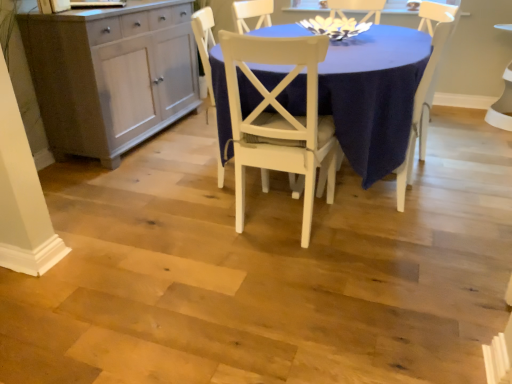
Question: From a real-world perspective, does white wood chair at center, which ranks as the first chair in right-to-left order, sit lower than matte gray cabinet at left?

Choices:
 (A) no
 (B) yes

Answer: (A)

Question: Is white wood chair at center, which is counted as the 3th chair, starting from the left, positioned far away from matte gray cabinet at left?

Choices:
 (A) yes
 (B) no

Answer: (A)

Question: Can you confirm if white wood chair at center, which is counted as the 3th chair, starting from the left, is positioned to the left of matte gray cabinet at left?

Choices:
 (A) yes
 (B) no

Answer: (B)

Question: Is white wood chair at center, which is counted as the 3th chair, starting from the left, taller than matte gray cabinet at left?

Choices:
 (A) no
 (B) yes

Answer: (B)

Question: Is white wood chair at center, which is counted as the 3th chair, starting from the left, wider than matte gray cabinet at left?

Choices:
 (A) yes
 (B) no

Answer: (B)

Question: From the image's perspective, is white wood chair at center, which ranks as the first chair in right-to-left order, beneath matte gray cabinet at left?

Choices:
 (A) no
 (B) yes

Answer: (B)

Question: Would you consider matte white table at center to be distant from matte gray cabinet at left?

Choices:
 (A) yes
 (B) no

Answer: (A)

Question: Is matte white table at center next to matte gray cabinet at left and touching it?

Choices:
 (A) no
 (B) yes

Answer: (A)

Question: Is matte white table at center at the left side of matte gray cabinet at left?

Choices:
 (A) yes
 (B) no

Answer: (B)

Question: Does matte white table at center come in front of matte gray cabinet at left?

Choices:
 (A) yes
 (B) no

Answer: (A)

Question: From the image's perspective, is matte white table at center beneath matte gray cabinet at left?

Choices:
 (A) no
 (B) yes

Answer: (B)

Question: Is matte white table at center shorter than matte gray cabinet at left?

Choices:
 (A) yes
 (B) no

Answer: (A)

Question: From a real-world perspective, is white wood chair at center, which is counted as the 3th chair, starting from the left, positioned over white matte chair at center, positioned as the second chair in right-to-left order, based on gravity?

Choices:
 (A) yes
 (B) no

Answer: (A)